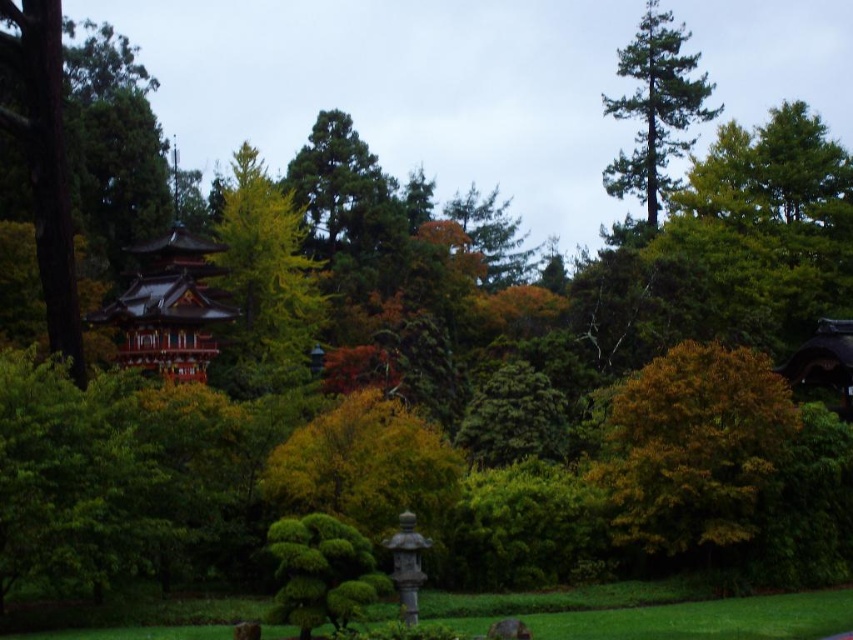
The height and width of the screenshot is (640, 853). What do you see at coordinates (693, 449) in the screenshot?
I see `yellow-green foliage at center-right` at bounding box center [693, 449].

Can you confirm if yellow-green foliage at center-right is bigger than shiny red wood temple at center?

Correct, yellow-green foliage at center-right is larger in size than shiny red wood temple at center.

Find the location of a particular element. The height and width of the screenshot is (640, 853). yellow-green foliage at center-right is located at coordinates (693, 449).

Locate an element on the screen. yellow-green foliage at center-right is located at coordinates (693, 449).

Who is more distant from viewer, [706,358] or [672,145]?

Positioned behind is point [672,145].

Looking at this image, does yellow-green foliage at center-right have a lesser width compared to green needle-like tree at upper right?

Correct, yellow-green foliage at center-right's width is less than green needle-like tree at upper right's.

Between point (647, 465) and point (636, 115), which one is positioned behind?

Positioned behind is point (636, 115).

What are the coordinates of `yellow-green foliage at center-right` in the screenshot? It's located at click(693, 449).

Is yellow-green leafy tree at center-left to the left of green needle-like tree at upper right from the viewer's perspective?

Correct, you'll find yellow-green leafy tree at center-left to the left of green needle-like tree at upper right.

Who is shorter, yellow-green leafy tree at center-left or green needle-like tree at upper right?

yellow-green leafy tree at center-left is shorter.

Is point (265, 250) farther from viewer compared to point (624, 156)?

No, (265, 250) is in front of (624, 156).

Identify the location of yellow-green leafy tree at center-left. This screenshot has width=853, height=640. (264, 284).